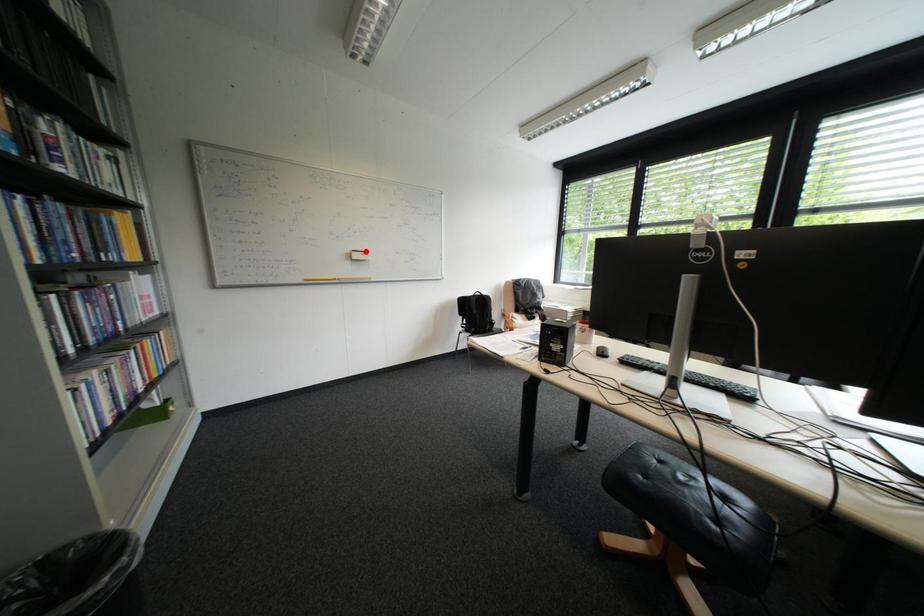
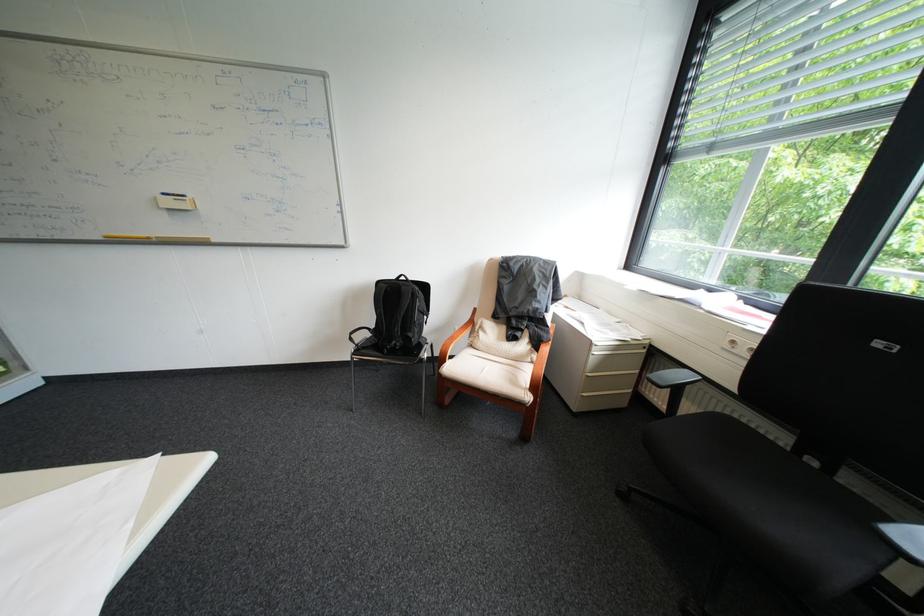
In the second image, find the point that corresponds to the highlighted location in the first image.

(176, 195)